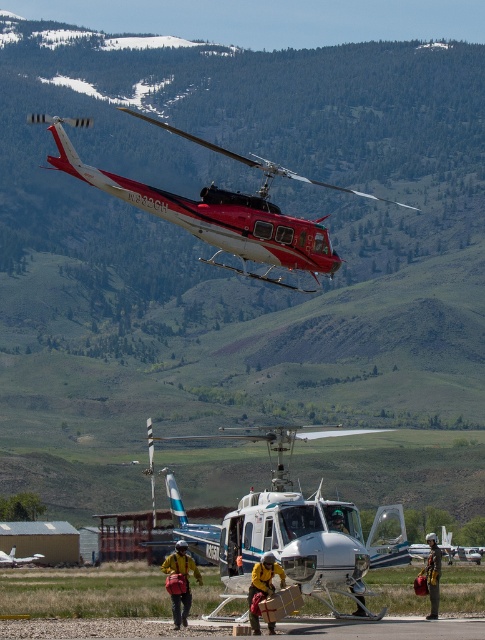
Who is more forward, (174, 208) or (395, 634)?

Positioned in front is point (395, 634).

Is point (165, 196) farther from camera compared to point (359, 628)?

That is True.

Does point (326, 237) come in front of point (208, 627)?

No, it is behind (208, 627).

You are a GUI agent. You are given a task and a screenshot of the screen. Output one action in this format:
    pyautogui.click(x=<x>, y=<y>)
    Task: Click on the metallic red helicopter at upper center
    
    Given the screenshot: What is the action you would take?
    pyautogui.click(x=217, y=209)

Can you confirm if concrete tarmac at center is taller than yellow fireproof suit at center?

Indeed, concrete tarmac at center has a greater height compared to yellow fireproof suit at center.

Consider the image. Is concrete tarmac at center closer to the viewer compared to yellow fireproof suit at center?

Yes.

Where is `concrete tarmac at center`? Image resolution: width=485 pixels, height=640 pixels. concrete tarmac at center is located at coordinates (383, 628).

This screenshot has width=485, height=640. Find the location of `concrete tarmac at center`. concrete tarmac at center is located at coordinates (383, 628).

Does yellow fabric jacket at center appear over yellow fireproof suit at center?

Incorrect, yellow fabric jacket at center is not positioned above yellow fireproof suit at center.

Is point (183, 625) positioned after point (267, 556)?

Yes, it is behind point (267, 556).

You are a GUI agent. You are given a task and a screenshot of the screen. Output one action in this format:
    pyautogui.click(x=<x>, y=<y>)
    Task: Click on the yellow fabric jacket at center
    The image size is (485, 640).
    Given the screenshot: What is the action you would take?
    pyautogui.click(x=179, y=580)